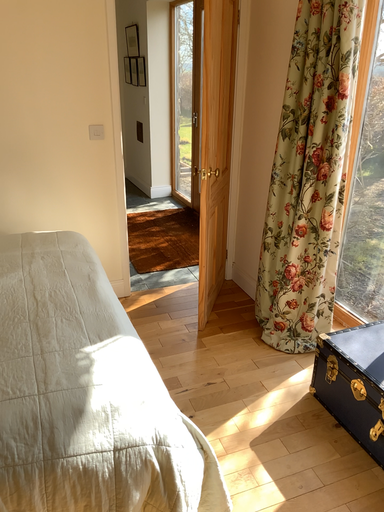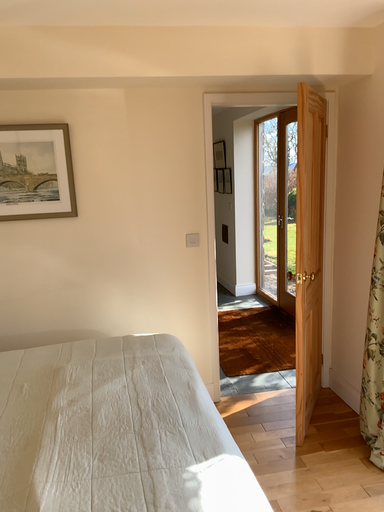
Question: Which way did the camera rotate in the video?

Choices:
 (A) rotated left
 (B) rotated right

Answer: (A)